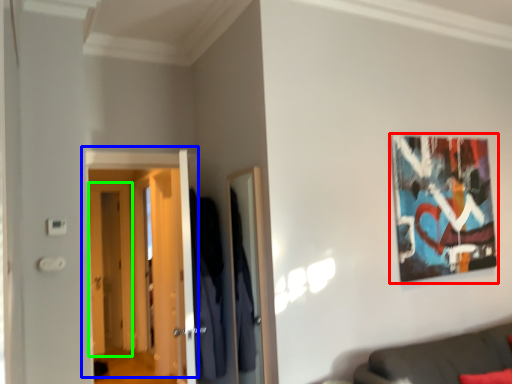
Question: Which is farther away from picture frame (highlighted by a red box)? door (highlighted by a blue box) or door (highlighted by a green box)?

Choices:
 (A) door
 (B) door

Answer: (B)